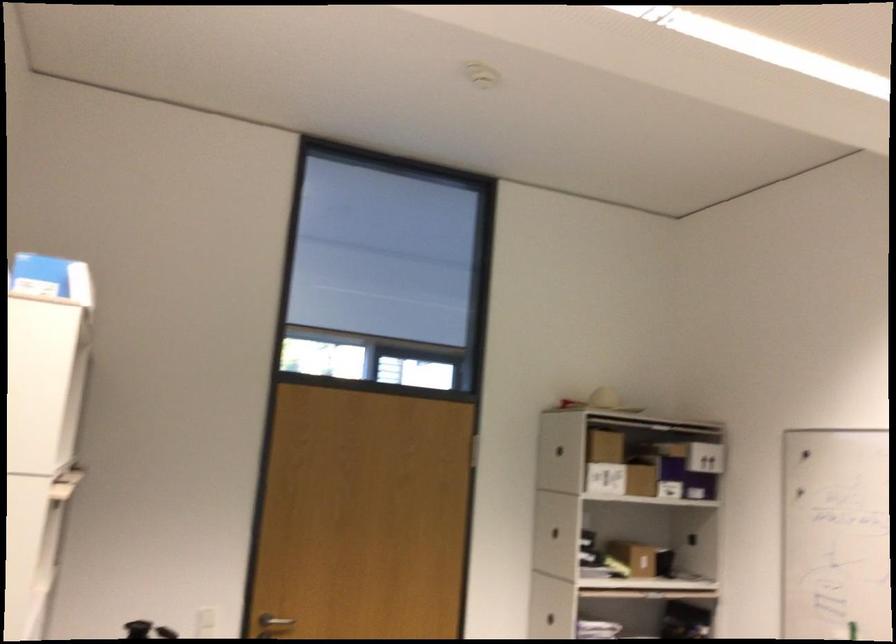
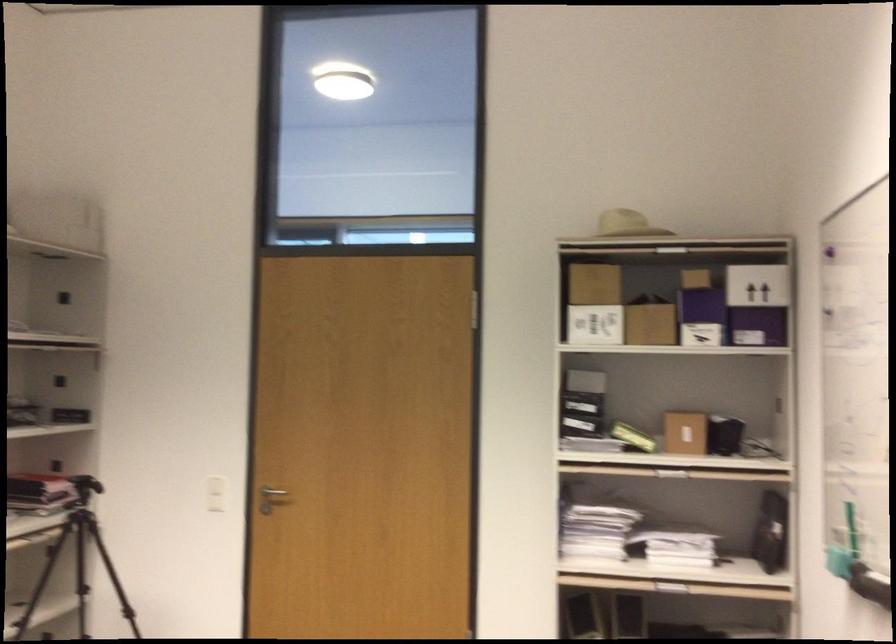
In the second image, find the point that corresponds to the point at 590,444 in the first image.

(592, 283)